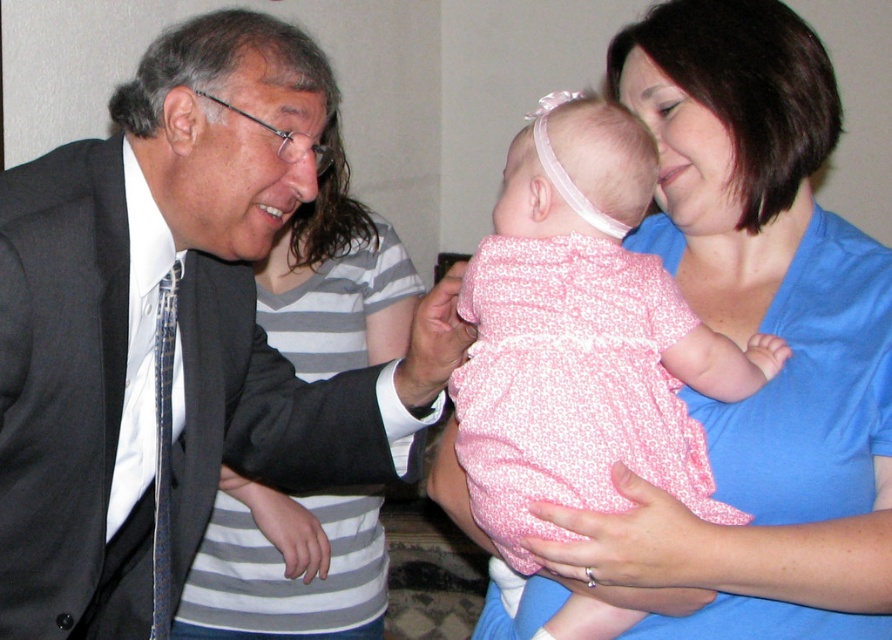
Can you confirm if matte black suit at left is thinner than white satin shirt at left?

No.

In the scene shown: Does matte black suit at left appear on the left side of white satin shirt at left?

Incorrect, matte black suit at left is not on the left side of white satin shirt at left.

Where is `matte black suit at left`? matte black suit at left is located at coordinates (286, 566).

Is point (145, 369) positioned after point (168, 364)?

That is True.

Identify the location of white satin shirt at left. (139, 342).

The width and height of the screenshot is (892, 640). What are the coordinates of `white satin shirt at left` in the screenshot? It's located at (139, 342).

Looking at this image, can you confirm if pink floral dress at center is bigger than white satin shirt at left?

Yes.

Measure the distance between pink floral dress at center and camera.

pink floral dress at center and camera are 37.39 inches apart from each other.

Between point (761, 384) and point (150, 448), which one is positioned behind?

Positioned behind is point (150, 448).

Image resolution: width=892 pixels, height=640 pixels. I want to click on pink floral dress at center, so click(583, 336).